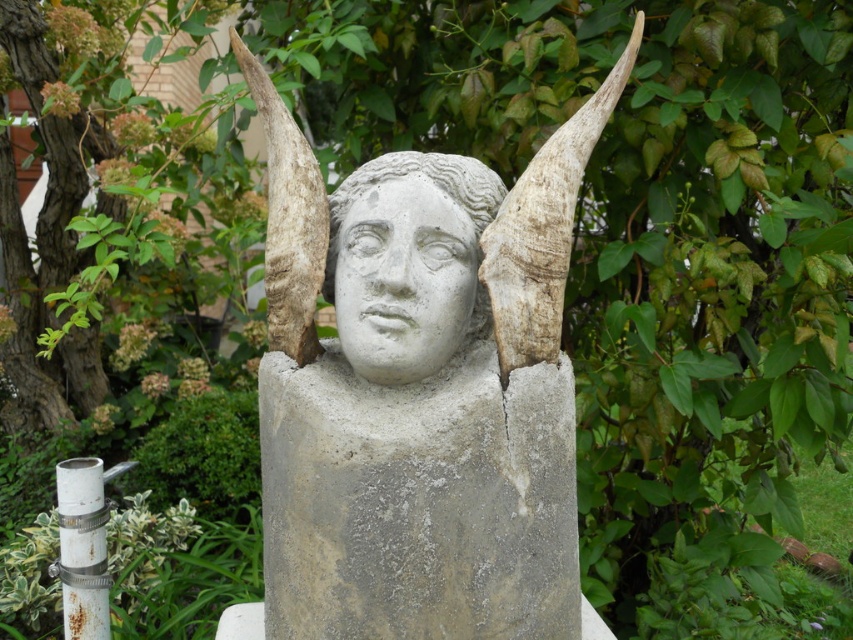
You are an art conservator examining the stone sculpture. You notice two points on the sculpture labeled as point 1 at coordinates [416,444] and point 2 at [453,285]. Which point is situated closer to your current position?

Point 1 at coordinates [416,444] is closer to the viewer than point 2 at [453,285].

You are an art conservator assessing two statues in a garden. You see the gray stone statue at center and the gray concrete statue at center. Which one do you think requires more frequent maintenance due to its material and size?

The gray stone statue at center requires more frequent maintenance because it is larger and made of a material that may erode more easily over time compared to the gray concrete statue at center.